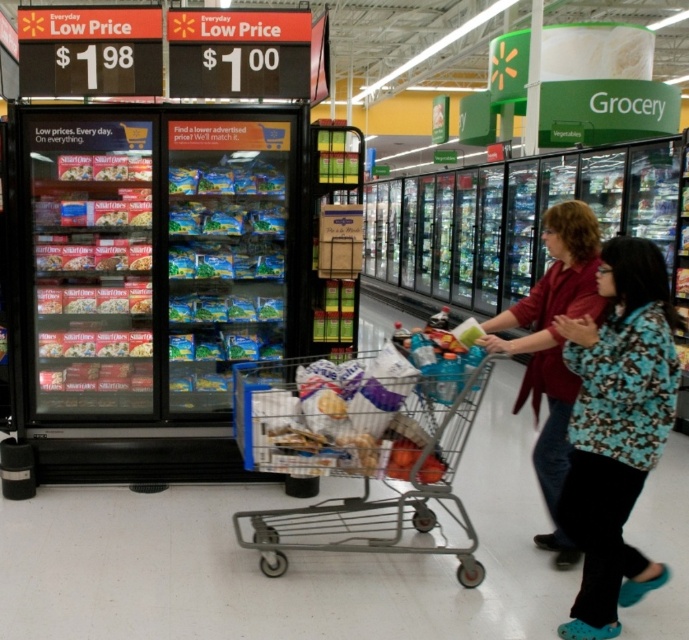
Is point (577, 438) closer to camera compared to point (597, 230)?

That is True.

Is point (575, 444) closer to viewer compared to point (544, 477)?

That is True.

This screenshot has width=689, height=640. I want to click on floral-patterned shirt at lower right, so click(617, 429).

Does point (344, 426) come farther from viewer compared to point (586, 252)?

No, (344, 426) is in front of (586, 252).

Does metallic silver shopping cart at center have a lesser height compared to matte red shirt at center?

Yes.

Locate an element on the screen. This screenshot has width=689, height=640. metallic silver shopping cart at center is located at coordinates (358, 451).

Can you confirm if metallic silver shopping cart at center is smaller than floral-patterned shirt at lower right?

Actually, metallic silver shopping cart at center might be larger than floral-patterned shirt at lower right.

Does metallic silver shopping cart at center appear on the right side of floral-patterned shirt at lower right?

Incorrect, metallic silver shopping cart at center is not on the right side of floral-patterned shirt at lower right.

Is point (263, 368) positioned behind point (639, 246)?

That is True.

Where is `metallic silver shopping cart at center`? The width and height of the screenshot is (689, 640). metallic silver shopping cart at center is located at coordinates (358, 451).